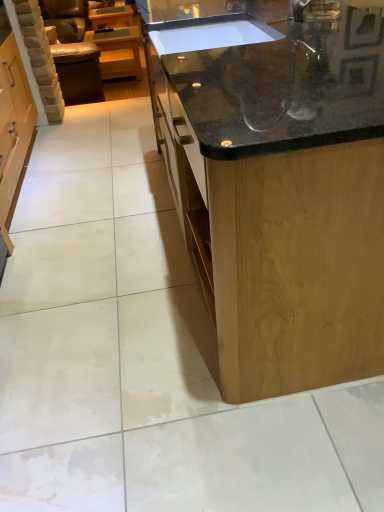
Question: From the image's perspective, is black granite countertop at center, arranged as the first countertop when viewed from the front, above or below black granite countertop at center, which appears as the 2th countertop when viewed from the front?

Choices:
 (A) above
 (B) below

Answer: (B)

Question: Is point (201, 192) positioned closer to the camera than point (327, 0)?

Choices:
 (A) closer
 (B) farther

Answer: (A)

Question: Based on their relative distances, which object is farther from the leather armchair at left?

Choices:
 (A) matte wood cabinet at upper left
 (B) black granite countertop at center, acting as the first countertop starting from the back
 (C) black granite countertop at center, arranged as the first countertop when viewed from the front

Answer: (C)

Question: Considering the real-world distances, which object is farthest from the leather armchair at left?

Choices:
 (A) black granite countertop at center, which appears as the 2th countertop when viewed from the front
 (B) matte wood cabinet at upper left
 (C) black granite countertop at center, arranged as the first countertop when viewed from the front

Answer: (C)